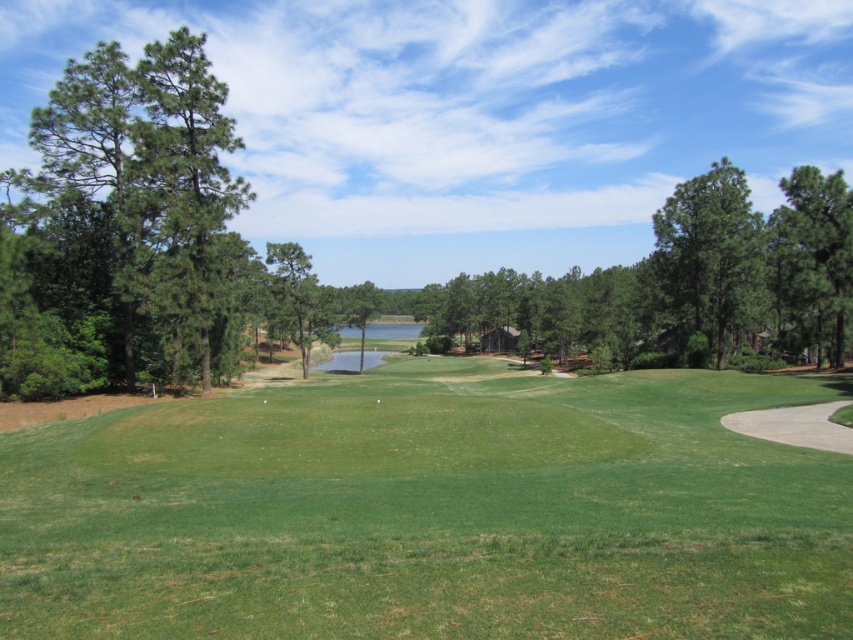
You are a golfer standing on the fairway and want to hit a golf ball towards the green area behind the trees. Which tree, the green matte tree at left or the green leafy tree at center, would you have to aim around first?

The green matte tree at left is closer to the viewer than the green leafy tree at center, so you would need to aim around the green matte tree at left first.

You are a golfer standing at the point with coordinates (431, 512). What do you see directly in front of you?

At point (431, 512) lies green grassy field at center.

From the picture: You are a golfer standing on the fairway and want to hit a golf ball towards the water in the midground. Which tree, the green matte tree at left or the green leafy tree at center, is closer to your left side?

The green matte tree at left is to the left of the green leafy tree at center, so it is closer to your left side.